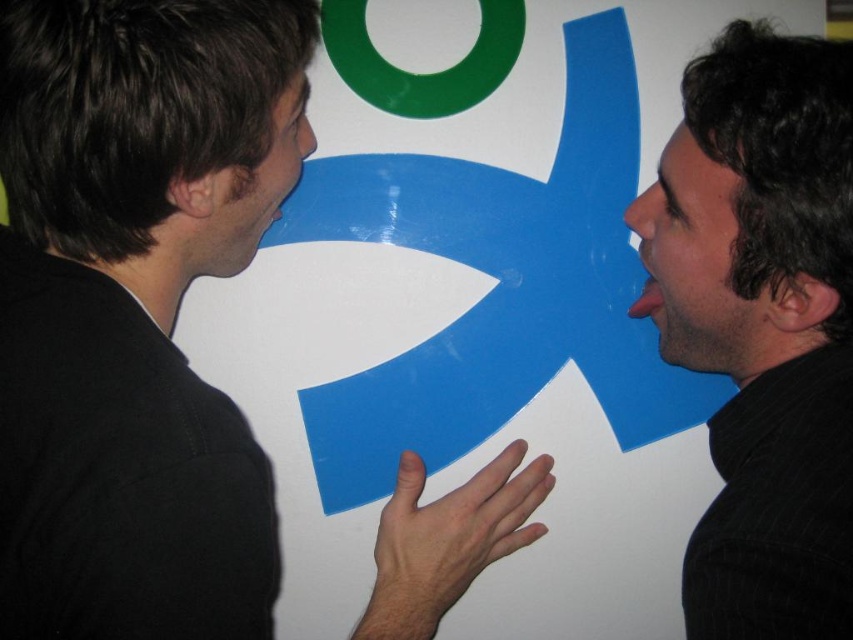
Question: Is black matte shirt at left in front of black textured hair at right?

Choices:
 (A) yes
 (B) no

Answer: (A)

Question: Does black matte shirt at left have a larger size compared to black textured hair at right?

Choices:
 (A) yes
 (B) no

Answer: (A)

Question: In this image, where is black matte shirt at left located relative to black textured hair at right?

Choices:
 (A) right
 (B) left

Answer: (B)

Question: Which point is closer to the camera?

Choices:
 (A) (51, 272)
 (B) (813, 300)

Answer: (A)

Question: Among these points, which one is nearest to the camera?

Choices:
 (A) (229, 141)
 (B) (753, 252)

Answer: (A)